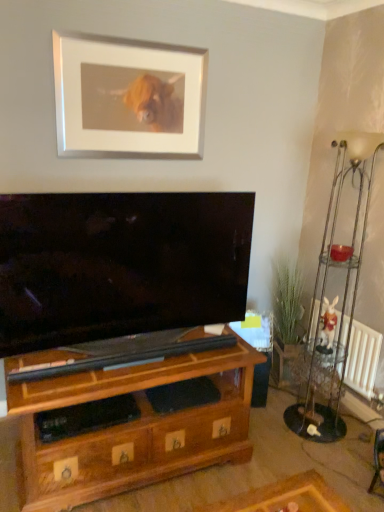
Image resolution: width=384 pixels, height=512 pixels. What are the coordinates of `free point behind metallic silver side table at right` in the screenshot? It's located at (294, 399).